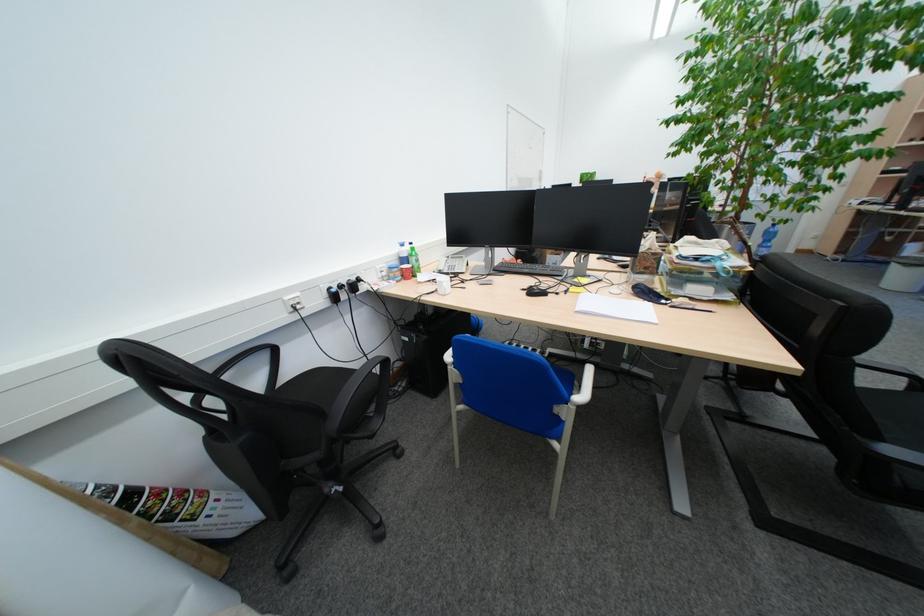
Find where to push the white chair armrest. Please return your answer as a coordinate pair (x, y).

(584, 387)